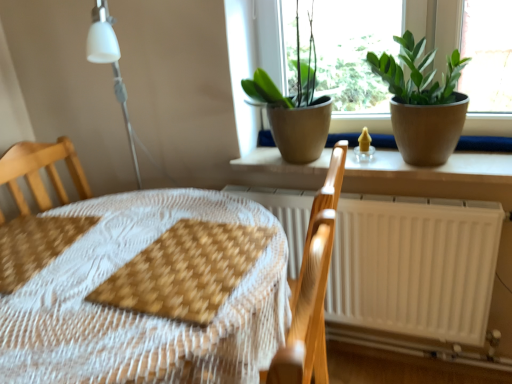
At what (x,y) coordinates should I click in order to perform the action: click on white matte radiator at lower right. Please return your answer as a coordinate pair (x, y). This screenshot has height=384, width=512. Looking at the image, I should click on (415, 266).

How much space does green matte plant at upper center, placed as the second houseplant when sorted from right to left, occupy horizontally?

It is 11.74 inches.

Where is `matte brown window sill at center`? matte brown window sill at center is located at coordinates (434, 168).

Locate an element on the screen. The height and width of the screenshot is (384, 512). light wood armchair at center is located at coordinates (311, 289).

Locate an element on the screen. brown woven placemat at center, which is the first sheet in right-to-left order is located at coordinates (185, 271).

In order to click on white matte radiator at lower right in this screenshot , I will do `click(415, 266)`.

Between brown woven placemat at lower left, arranged as the 2th sheet when viewed from the right, and light wood armchair at center, which one has smaller size?

With smaller size is brown woven placemat at lower left, arranged as the 2th sheet when viewed from the right.

Where is `armchair below the brown woven placemat at lower left, placed as the first sheet when sorted from left to right (from a real-world perspective)`? Image resolution: width=512 pixels, height=384 pixels. armchair below the brown woven placemat at lower left, placed as the first sheet when sorted from left to right (from a real-world perspective) is located at coordinates (311, 289).

From a real-world perspective, which object stands above the other?

brown woven placemat at lower left, placed as the first sheet when sorted from left to right, is physically above.

Looking at this image, would you say matte yellow candle holder at center contains brown woven placemat at center, which is the first sheet in right-to-left order?

No, brown woven placemat at center, which is the first sheet in right-to-left order, is located outside of matte yellow candle holder at center.

From the image's perspective, does matte yellow candle holder at center appear lower than brown woven placemat at center, which is the first sheet in right-to-left order?

No, from the image's perspective, matte yellow candle holder at center is not beneath brown woven placemat at center, which is the first sheet in right-to-left order.

Which point is more distant from viewer, (354,151) or (229,281)?

Point (354,151)

From the image's perspective, would you say green matte plant at upper center, which appears as the first houseplant when viewed from the left, is shown under wooden placemat at center?

Actually, green matte plant at upper center, which appears as the first houseplant when viewed from the left, appears above wooden placemat at center in the image.

Between green matte plant at upper center, placed as the second houseplant when sorted from right to left, and wooden placemat at center, which one appears on the right side from the viewer's perspective?

green matte plant at upper center, placed as the second houseplant when sorted from right to left, is more to the right.

Which of these two, green matte plant at upper center, placed as the second houseplant when sorted from right to left, or wooden placemat at center, is thinner?

green matte plant at upper center, placed as the second houseplant when sorted from right to left.

Is green matte plant at upper center, which appears as the first houseplant when viewed from the left, oriented away from wooden placemat at center?

No, green matte plant at upper center, which appears as the first houseplant when viewed from the left, is not facing away from wooden placemat at center.

Based on the photo, considering the relative positions of brown woven placemat at center, which is the first sheet in right-to-left order, and matte yellow candle holder at center in the image provided, is brown woven placemat at center, which is the first sheet in right-to-left order, to the right of matte yellow candle holder at center from the viewer's perspective?

No.

Is brown woven placemat at center, arranged as the 2th sheet when viewed from the left, facing towards matte yellow candle holder at center?

No, brown woven placemat at center, arranged as the 2th sheet when viewed from the left, does not turn towards matte yellow candle holder at center.

Is brown woven placemat at center, arranged as the 2th sheet when viewed from the left, not within matte yellow candle holder at center?

Yes, brown woven placemat at center, arranged as the 2th sheet when viewed from the left, is not within matte yellow candle holder at center.

From a real-world perspective, is brown woven placemat at center, arranged as the 2th sheet when viewed from the left, positioned over matte yellow candle holder at center based on gravity?

No, from a real-world perspective, brown woven placemat at center, arranged as the 2th sheet when viewed from the left, is not over matte yellow candle holder at center

Who is shorter, brown woven placemat at center, which is the first sheet in right-to-left order, or matte brown window sill at center?

Standing shorter between the two is brown woven placemat at center, which is the first sheet in right-to-left order.

Considering the relative sizes of brown woven placemat at center, which is the first sheet in right-to-left order, and matte brown window sill at center in the image provided, is brown woven placemat at center, which is the first sheet in right-to-left order, thinner than matte brown window sill at center?

Incorrect, the width of brown woven placemat at center, which is the first sheet in right-to-left order, is not less than that of matte brown window sill at center.

From a real-world perspective, is brown woven placemat at center, which is the first sheet in right-to-left order, on matte brown window sill at center?

No, from a real-world perspective, brown woven placemat at center, which is the first sheet in right-to-left order, is not over matte brown window sill at center

Which is in front, brown woven placemat at center, which is the first sheet in right-to-left order, or matte brown window sill at center?

brown woven placemat at center, which is the first sheet in right-to-left order.

How much distance is there between green matte plant at upper right, the 2th houseplant viewed from the left, and matte yellow candle holder at center?

green matte plant at upper right, the 2th houseplant viewed from the left, is 10.12 inches away from matte yellow candle holder at center.

Is green matte plant at upper right, positioned as the first houseplant in right-to-left order, positioned behind matte yellow candle holder at center?

That is False.

Which of these two, green matte plant at upper right, the 2th houseplant viewed from the left, or matte yellow candle holder at center, stands shorter?

Standing shorter between the two is matte yellow candle holder at center.

Does green matte plant at upper right, the 2th houseplant viewed from the left, turn towards matte yellow candle holder at center?

No, green matte plant at upper right, the 2th houseplant viewed from the left, is not facing towards matte yellow candle holder at center.

Which is closer to the camera, (301, 315) or (258, 27)?

Point (301, 315) appears to be closer to the viewer than point (258, 27).

Could you tell me if light wood armchair at center is turned towards green matte plant at upper center, which appears as the first houseplant when viewed from the left?

No.

Consider the image. Considering the relative sizes of light wood armchair at center and green matte plant at upper center, placed as the second houseplant when sorted from right to left, in the image provided, is light wood armchair at center bigger than green matte plant at upper center, placed as the second houseplant when sorted from right to left,?

Correct, light wood armchair at center is larger in size than green matte plant at upper center, placed as the second houseplant when sorted from right to left.

Locate an element on the screen. Image resolution: width=512 pixels, height=384 pixels. sheet that appears behind the light wood armchair at center is located at coordinates (35, 245).

Where is `candle holder to the right of brown woven placemat at center, arranged as the 2th sheet when viewed from the left`? candle holder to the right of brown woven placemat at center, arranged as the 2th sheet when viewed from the left is located at coordinates point(364,147).

Looking at this image, looking at the image, which one is located further to light wood armchair at center, brown woven placemat at lower left, placed as the first sheet when sorted from left to right, or wooden placemat at center?

brown woven placemat at lower left, placed as the first sheet when sorted from left to right.

Which object lies nearer to the anchor point wooden placemat at center, matte yellow candle holder at center or brown woven placemat at center, which is the first sheet in right-to-left order?

brown woven placemat at center, which is the first sheet in right-to-left order, is positioned closer to the anchor wooden placemat at center.

Looking at the image, which one is located closer to wooden placemat at center, brown woven placemat at center, which is the first sheet in right-to-left order, or white matte radiator at lower right?

The object closer to wooden placemat at center is brown woven placemat at center, which is the first sheet in right-to-left order.

Looking at the image, which one is located further to green matte plant at upper center, placed as the second houseplant when sorted from right to left, matte yellow candle holder at center or matte brown window sill at center?

The object further to green matte plant at upper center, placed as the second houseplant when sorted from right to left, is matte yellow candle holder at center.

Looking at the image, which one is located closer to brown woven placemat at center, arranged as the 2th sheet when viewed from the left, brown woven placemat at lower left, placed as the first sheet when sorted from left to right, or wooden placemat at center?

wooden placemat at center is positioned closer to the anchor brown woven placemat at center, arranged as the 2th sheet when viewed from the left.

Which object lies further to the anchor point matte yellow candle holder at center, wooden placemat at center or matte brown window sill at center?

wooden placemat at center lies further to matte yellow candle holder at center than the other object.

Looking at the image, which one is located further to green matte plant at upper right, the 2th houseplant viewed from the left, wooden placemat at center or matte yellow candle holder at center?

The object further to green matte plant at upper right, the 2th houseplant viewed from the left, is wooden placemat at center.

From the image, which object appears to be farther from white matte radiator at lower right, wooden placemat at center or green matte plant at upper center, placed as the second houseplant when sorted from right to left?

Among the two, wooden placemat at center is located further to white matte radiator at lower right.

Locate an element on the screen. The height and width of the screenshot is (384, 512). sheet between brown woven placemat at lower left, arranged as the 2th sheet when viewed from the right, and light wood armchair at center is located at coordinates (185, 271).

At what (x,y) coordinates should I click in order to perform the action: click on armchair between brown woven placemat at center, which is the first sheet in right-to-left order, and green matte plant at upper right, the 2th houseplant viewed from the left. Please return your answer as a coordinate pair (x, y). The image size is (512, 384). Looking at the image, I should click on (311, 289).

In order to click on radiator between green matte plant at upper right, positioned as the first houseplant in right-to-left order, and light wood armchair at center vertically in this screenshot , I will do `click(415, 266)`.

Identify the location of candle holder between green matte plant at upper center, which appears as the first houseplant when viewed from the left, and light wood armchair at center in the up-down direction. Image resolution: width=512 pixels, height=384 pixels. (364, 147).